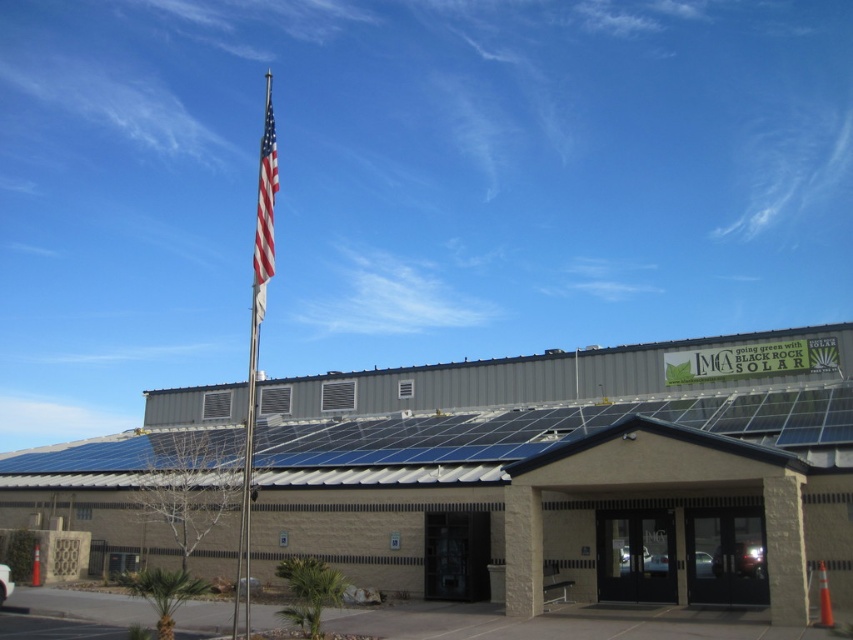
Is polished silver flag pole at upper center bigger than red-white-striped flag at upper center?

Correct, polished silver flag pole at upper center is larger in size than red-white-striped flag at upper center.

Does polished silver flag pole at upper center have a greater height compared to red-white-striped flag at upper center?

Correct, polished silver flag pole at upper center is much taller as red-white-striped flag at upper center.

Between point (254, 307) and point (260, 266), which one is positioned behind?

The point (260, 266) is more distant.

Find the location of `polished silver flag pole at upper center`. polished silver flag pole at upper center is located at coordinates [x=256, y=339].